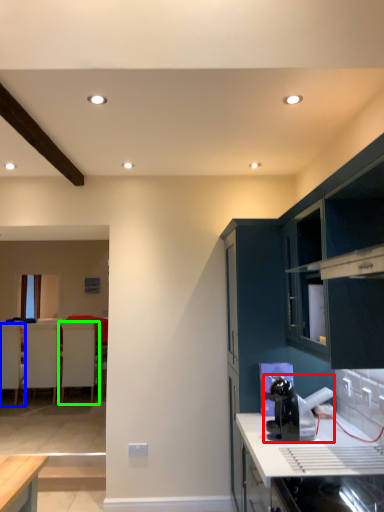
Question: Which object is the closest to the appliance (highlighted by a red box)? Choose among these: armchair (highlighted by a blue box) or armchair (highlighted by a green box).

Choices:
 (A) armchair
 (B) armchair

Answer: (B)